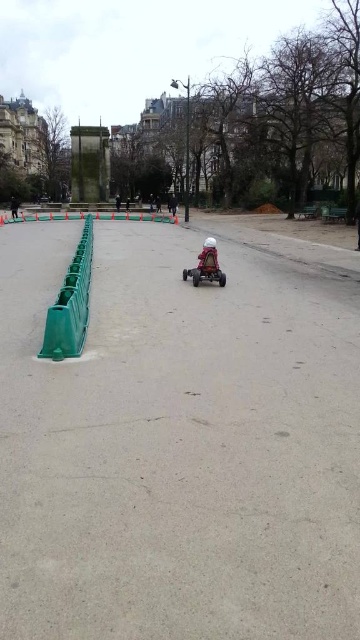
Is matte red toy car at center shorter than matte red car at center?

Yes.

This screenshot has width=360, height=640. Describe the element at coordinates (205, 266) in the screenshot. I see `matte red toy car at center` at that location.

The width and height of the screenshot is (360, 640). I want to click on matte red toy car at center, so click(205, 266).